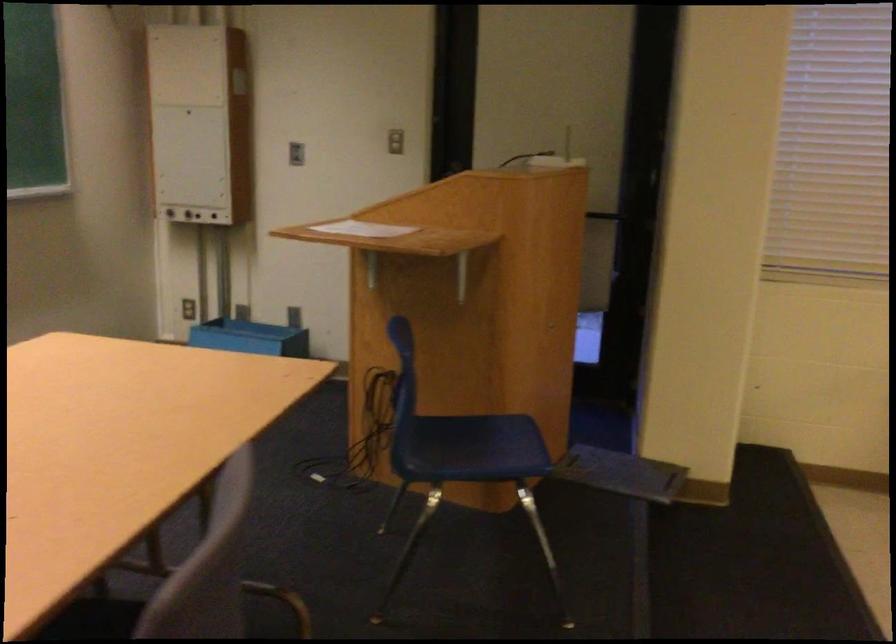
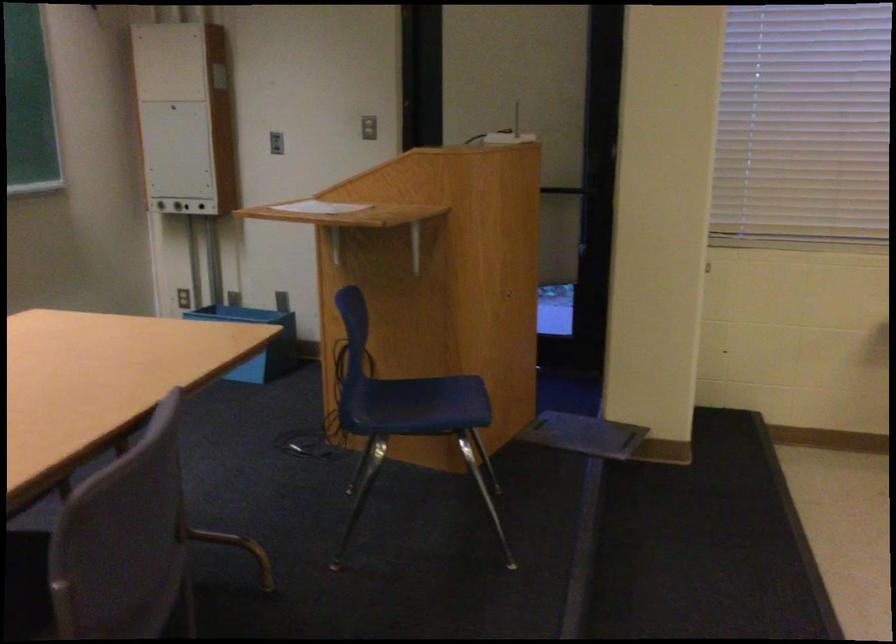
Find the pixel in the second image that matches point 474,438 in the first image.

(424, 398)